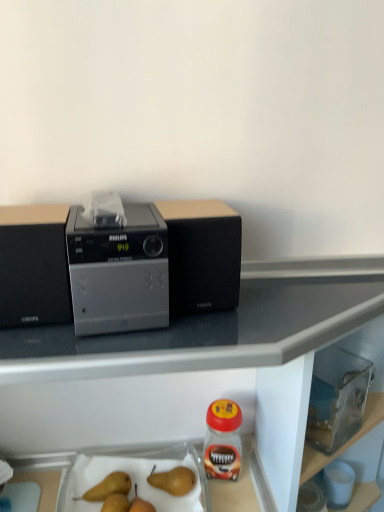
Where is `black matte speaker at center, the 1th kitchen appliance positioned from the right`? black matte speaker at center, the 1th kitchen appliance positioned from the right is located at coordinates (202, 255).

Image resolution: width=384 pixels, height=512 pixels. What do you see at coordinates (337, 398) in the screenshot?
I see `transparent plastic container at lower right` at bounding box center [337, 398].

What do you see at coordinates (116, 495) in the screenshot? This screenshot has width=384, height=512. I see `smooth brown pears at lower center, the 2th fruit when ordered from left to right` at bounding box center [116, 495].

Where is `satin silver radio at center`? satin silver radio at center is located at coordinates (119, 272).

The width and height of the screenshot is (384, 512). What do you see at coordinates (223, 440) in the screenshot? I see `clear glass jar at lower right` at bounding box center [223, 440].

Locate an element on the screen. This screenshot has width=384, height=512. black glossy table at upper center is located at coordinates (188, 369).

Is yellow matte pear at lower center, which is the 3th fruit from left to right, facing towards black matte speaker at center, the 1th kitchen appliance positioned from the right?

No, yellow matte pear at lower center, which is the 3th fruit from left to right, is not turned towards black matte speaker at center, the 1th kitchen appliance positioned from the right.

Considering the sizes of yellow matte pear at lower center, which is the 3th fruit from left to right, and black matte speaker at center, the 1th kitchen appliance positioned from the right, in the image, is yellow matte pear at lower center, which is the 3th fruit from left to right, bigger or smaller than black matte speaker at center, the 1th kitchen appliance positioned from the right,?

In the image, yellow matte pear at lower center, which is the 3th fruit from left to right, appears to be smaller than black matte speaker at center, the 1th kitchen appliance positioned from the right.

Based on the photo, is yellow matte pear at lower center, which is the 3th fruit from left to right, outside of black matte speaker at center, the 1th kitchen appliance positioned from the right?

Absolutely, yellow matte pear at lower center, which is the 3th fruit from left to right, is external to black matte speaker at center, the 1th kitchen appliance positioned from the right.

Looking at the image, does clear glass jar at lower right seem bigger or smaller compared to black matte speaker at center, the second kitchen appliance from the left?

Considering their sizes, clear glass jar at lower right takes up less space than black matte speaker at center, the second kitchen appliance from the left.

Considering the relative positions of clear glass jar at lower right and black matte speaker at center, the second kitchen appliance from the left, in the image provided, is clear glass jar at lower right in front of black matte speaker at center, the second kitchen appliance from the left,?

No, the depth of clear glass jar at lower right is greater than that of black matte speaker at center, the second kitchen appliance from the left.

Is clear glass jar at lower right surrounding black matte speaker at center, the 1th kitchen appliance positioned from the right?

No, black matte speaker at center, the 1th kitchen appliance positioned from the right, is not surrounded by clear glass jar at lower right.

From the image's perspective, who appears lower, clear glass jar at lower right or black matte speaker at center, the second kitchen appliance from the left?

clear glass jar at lower right, from the image's perspective.

Is black matte speaker at center, the 1th kitchen appliance positioned from the right, not inside transparent plastic container at lower right?

Yes, black matte speaker at center, the 1th kitchen appliance positioned from the right, is outside of transparent plastic container at lower right.

Looking at the image, does black matte speaker at center, the second kitchen appliance from the left, seem bigger or smaller compared to transparent plastic container at lower right?

Clearly, black matte speaker at center, the second kitchen appliance from the left, is larger in size than transparent plastic container at lower right.

From the image's perspective, which object appears higher, black matte speaker at center, the second kitchen appliance from the left, or transparent plastic container at lower right?

black matte speaker at center, the second kitchen appliance from the left.

How different are the orientations of black glossy table at upper center and smooth brown pear at lower left, the first fruit from the left, in degrees?

There is a 93.9-degree angle between the facing directions of black glossy table at upper center and smooth brown pear at lower left, the first fruit from the left.

Which of these two, black glossy table at upper center or smooth brown pear at lower left, the first fruit from the left, is smaller?

smooth brown pear at lower left, the first fruit from the left, is smaller.

Would you say black glossy table at upper center is outside smooth brown pear at lower left, acting as the third fruit starting from the right?

Yes, black glossy table at upper center is located beyond the bounds of smooth brown pear at lower left, acting as the third fruit starting from the right.

Between point (22, 399) and point (96, 488), which one is positioned in front?

The point (96, 488) is more forward.

Is point (102, 495) closer or farther from the camera than point (96, 248)?

Point (102, 495) appears to be farther away from the viewer than point (96, 248).

Does smooth brown pear at lower left, the first fruit from the left, have a larger size compared to satin silver radio at center?

No.

Based on the photo, considering the sizes of smooth brown pear at lower left, the first fruit from the left, and satin silver radio at center in the image, is smooth brown pear at lower left, the first fruit from the left, wider or thinner than satin silver radio at center?

smooth brown pear at lower left, the first fruit from the left, is thinner than satin silver radio at center.

From a real-world perspective, is smooth brown pear at lower left, the first fruit from the left, on satin silver radio at center?

Actually, smooth brown pear at lower left, the first fruit from the left, is physically below satin silver radio at center in the real world.

Which object is closer to the camera taking this photo, yellow matte pear at lower center, which is the 3th fruit from left to right, or smooth brown pear at lower left, acting as the third fruit starting from the right?

smooth brown pear at lower left, acting as the third fruit starting from the right, is closer to the camera.

Which object is positioned more to the left, yellow matte pear at lower center, which is the 3th fruit from left to right, or smooth brown pear at lower left, the first fruit from the left?

smooth brown pear at lower left, the first fruit from the left.

From the picture: Would you say yellow matte pear at lower center, which is the 3th fruit from left to right, is inside or outside smooth brown pear at lower left, acting as the third fruit starting from the right?

yellow matte pear at lower center, which is the 3th fruit from left to right, is not enclosed by smooth brown pear at lower left, acting as the third fruit starting from the right.

You are a GUI agent. You are given a task and a screenshot of the screen. Output one action in this format:
    pyautogui.click(x=<x>, y=<y>)
    Task: Click on the 1st fruit in front of the yellow matte pear at lower center, which is the 3th fruit from left to right, counting from the anchor's position
    The width and height of the screenshot is (384, 512).
    Given the screenshot: What is the action you would take?
    pyautogui.click(x=108, y=487)

Which point is more forward, (x=154, y=480) or (x=0, y=270)?

Point (x=0, y=270)

In the scene shown: From the image's perspective, is yellow matte pear at lower center, which is the 3th fruit from left to right, located above or below black matte speaker at left, the second kitchen appliance when ordered from right to left?

Based on their image positions, yellow matte pear at lower center, which is the 3th fruit from left to right, is located beneath black matte speaker at left, the second kitchen appliance when ordered from right to left.

This screenshot has width=384, height=512. Find the location of `the 1st fruit below the black matte speaker at left, the first kitchen appliance viewed from the left (from the image's perspective)`. the 1st fruit below the black matte speaker at left, the first kitchen appliance viewed from the left (from the image's perspective) is located at coordinates (173, 480).

From their relative heights in the image, would you say yellow matte pear at lower center, acting as the 1th fruit starting from the right, is taller or shorter than black matte speaker at left, the first kitchen appliance viewed from the left?

In the image, yellow matte pear at lower center, acting as the 1th fruit starting from the right, appears to be shorter than black matte speaker at left, the first kitchen appliance viewed from the left.

Where is `the 2nd kitchen appliance located above the yellow matte pear at lower center, acting as the 1th fruit starting from the right (from a real-world perspective)`? the 2nd kitchen appliance located above the yellow matte pear at lower center, acting as the 1th fruit starting from the right (from a real-world perspective) is located at coordinates (202, 255).

This screenshot has height=512, width=384. In order to click on bottle behind the black matte speaker at center, the second kitchen appliance from the left in this screenshot , I will do `click(223, 440)`.

Which object lies further to the anchor point satin silver radio at center, black glossy table at upper center or transparent plastic container at lower right?

Based on the image, transparent plastic container at lower right appears to be further to satin silver radio at center.

When comparing their distances from clear glass jar at lower right, does transparent plastic container at lower right or black matte speaker at left, the first kitchen appliance viewed from the left, seem further?

Based on the image, black matte speaker at left, the first kitchen appliance viewed from the left, appears to be further to clear glass jar at lower right.

Based on the photo, estimate the real-world distances between objects in this image. Which object is further from black glossy table at upper center, black matte speaker at left, the first kitchen appliance viewed from the left, or black matte speaker at center, the second kitchen appliance from the left?

black matte speaker at left, the first kitchen appliance viewed from the left, is further to black glossy table at upper center.

Estimate the real-world distances between objects in this image. Which object is further from yellow matte pear at lower center, which is the 3th fruit from left to right, black matte speaker at center, the second kitchen appliance from the left, or transparent plastic container at lower right?

The object further to yellow matte pear at lower center, which is the 3th fruit from left to right, is black matte speaker at center, the second kitchen appliance from the left.

From the image, which object appears to be farther from smooth brown pear at lower left, acting as the third fruit starting from the right, transparent plastic container at lower right or clear glass jar at lower right?

transparent plastic container at lower right is positioned further to the anchor smooth brown pear at lower left, acting as the third fruit starting from the right.

Which object lies nearer to the anchor point clear glass jar at lower right, transparent plastic container at lower right or black matte speaker at center, the 1th kitchen appliance positioned from the right?

transparent plastic container at lower right.

Based on their spatial positions, is black glossy table at upper center or smooth brown pear at lower left, acting as the third fruit starting from the right, closer to black matte speaker at center, the second kitchen appliance from the left?

Among the two, black glossy table at upper center is located nearer to black matte speaker at center, the second kitchen appliance from the left.

Looking at the image, which one is located closer to black matte speaker at center, the 1th kitchen appliance positioned from the right, smooth brown pear at lower left, the first fruit from the left, or black matte speaker at left, the first kitchen appliance viewed from the left?

black matte speaker at left, the first kitchen appliance viewed from the left, is closer to black matte speaker at center, the 1th kitchen appliance positioned from the right.

The height and width of the screenshot is (512, 384). Identify the location of kitchen appliance between satin silver radio at center and smooth brown pear at lower left, acting as the third fruit starting from the right, vertically. (34, 266).

The image size is (384, 512). In order to click on bottle between satin silver radio at center and black glossy table at upper center in the vertical direction in this screenshot , I will do `click(223, 440)`.

I want to click on bottle between black matte speaker at left, the first kitchen appliance viewed from the left, and smooth brown pears at lower center, the second fruit positioned from the right, in the vertical direction, so click(x=223, y=440).

Image resolution: width=384 pixels, height=512 pixels. In order to click on bottle between black matte speaker at left, the second kitchen appliance when ordered from right to left, and yellow matte pear at lower center, acting as the 1th fruit starting from the right, from top to bottom in this screenshot , I will do `click(223, 440)`.